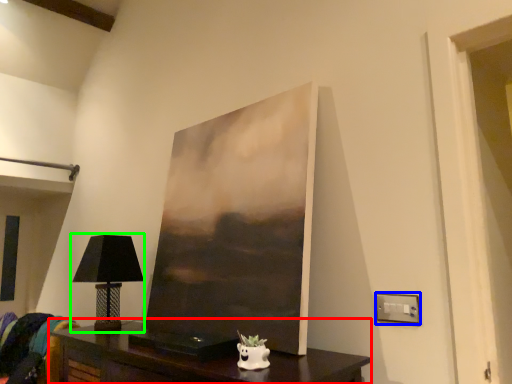
Question: Which object is positioned closest to table (highlighted by a red box)? Select from electric outlet (highlighted by a blue box) and table lamp (highlighted by a green box).

Choices:
 (A) electric outlet
 (B) table lamp

Answer: (B)